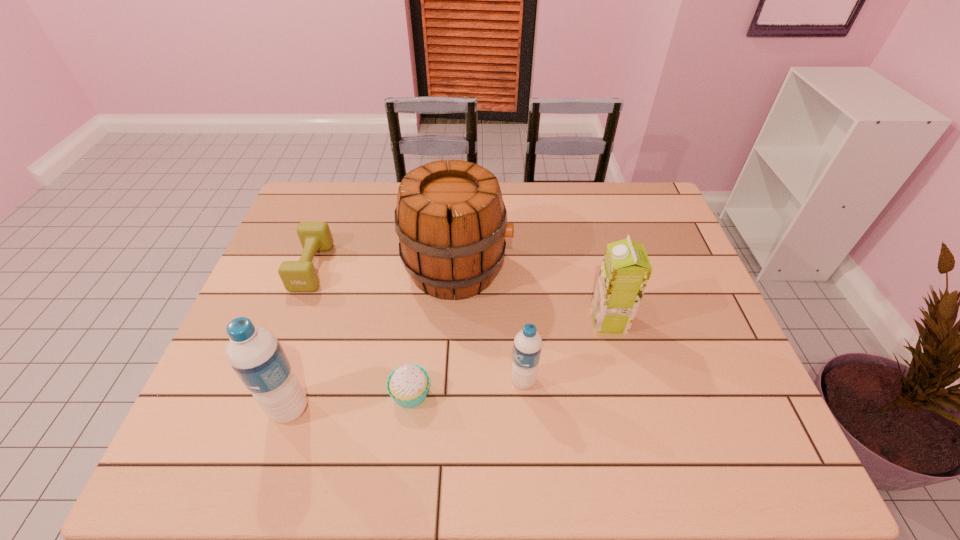
You are a GUI agent. You are given a task and a screenshot of the screen. Output one action in this format:
    pyautogui.click(x=<x>, y=<y>)
    Task: Click on the left water bottle
    
    Given the screenshot: What is the action you would take?
    pyautogui.click(x=255, y=354)

This screenshot has height=540, width=960. In order to click on the right water bottle in this screenshot , I will do `click(527, 347)`.

Where is `the fourth tallest object`? The image size is (960, 540). the fourth tallest object is located at coordinates (527, 347).

Image resolution: width=960 pixels, height=540 pixels. In order to click on the rightmost object in this screenshot , I will do `click(625, 270)`.

The width and height of the screenshot is (960, 540). I want to click on the third farthest object, so pos(625,270).

Find the location of a particular element. This screenshot has width=960, height=540. the shortest object is located at coordinates (297, 276).

Locate an element on the screen. The width and height of the screenshot is (960, 540). cider is located at coordinates (452, 225).

The image size is (960, 540). Find the location of `cupcake`. cupcake is located at coordinates (408, 384).

Where is `free space located on the label of the left water bottle`? This screenshot has width=960, height=540. free space located on the label of the left water bottle is located at coordinates (233, 409).

Find the location of `blank space located 0.090m on the label of the left water bottle`. blank space located 0.090m on the label of the left water bottle is located at coordinates (228, 409).